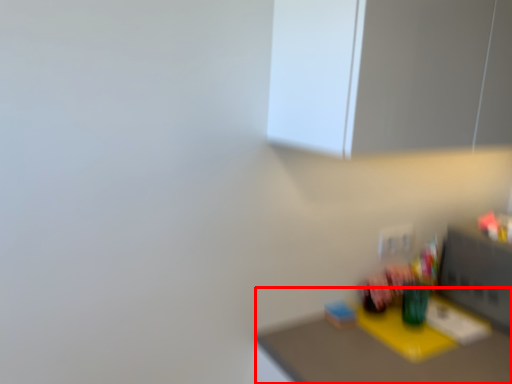
Question: Where is table (annotated by the red box) located in relation to medicine cabinet in the image?

Choices:
 (A) left
 (B) right

Answer: (B)